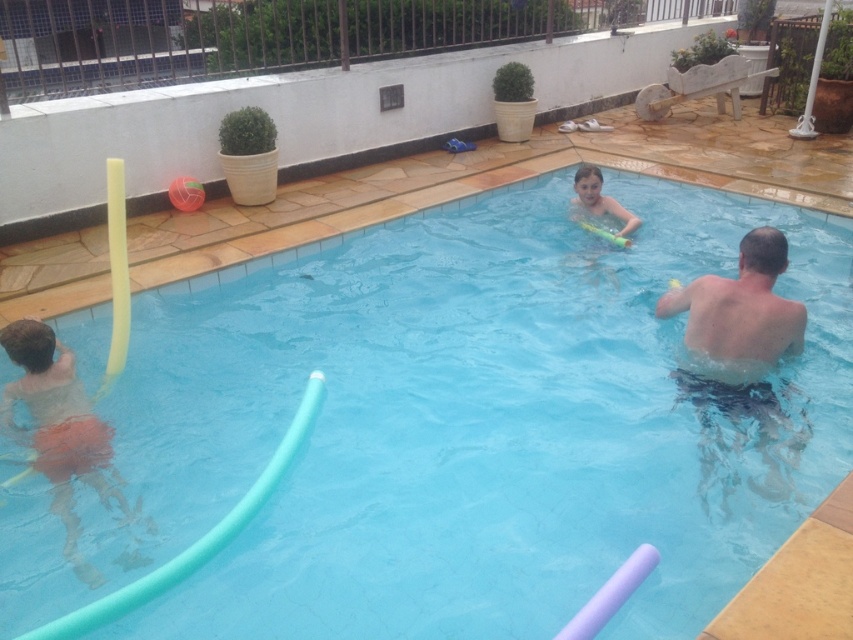
Between blue rubber pool float at lower left and smooth yellow float at upper center, which one appears on the right side from the viewer's perspective?

smooth yellow float at upper center

Does point (714, 506) lie in front of point (614, 208)?

Yes, it is in front of point (614, 208).

Locate an element on the screen. The height and width of the screenshot is (640, 853). blue rubber pool float at lower left is located at coordinates (468, 422).

Who is shorter, matte orange shorts at left or smooth yellow float at upper center?

With less height is smooth yellow float at upper center.

Looking at this image, is matte orange shorts at left to the right of smooth yellow float at upper center from the viewer's perspective?

Incorrect, matte orange shorts at left is not on the right side of smooth yellow float at upper center.

Is point (93, 448) farther from camera compared to point (590, 170)?

No, (93, 448) is in front of (590, 170).

Locate an element on the screen. The height and width of the screenshot is (640, 853). matte orange shorts at left is located at coordinates tap(61, 428).

Between skinny blue shorts at right and matte orange shorts at left, which one is positioned lower?

matte orange shorts at left is lower down.

Does point (775, 461) come behind point (112, 493)?

Yes, point (775, 461) is farther from viewer.

Who is more distant from viewer, (689, 392) or (65, 384)?

The point (689, 392) is behind.

You are a GUI agent. You are given a task and a screenshot of the screen. Output one action in this format:
    pyautogui.click(x=<x>, y=<y>)
    Task: Click on the skinny blue shorts at right
    The image size is (853, 640).
    Given the screenshot: What is the action you would take?
    (738, 340)